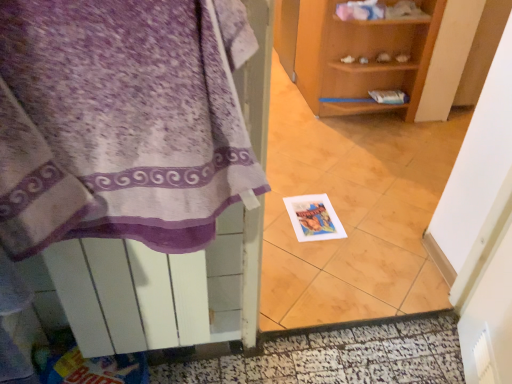
Question: Does wooden shelf at center have a greater height compared to white glossy tile at center?

Choices:
 (A) yes
 (B) no

Answer: (B)

Question: Is the depth of wooden shelf at center greater than that of white glossy tile at center?

Choices:
 (A) yes
 (B) no

Answer: (A)

Question: Does wooden shelf at center have a greater width compared to white glossy tile at center?

Choices:
 (A) no
 (B) yes

Answer: (B)

Question: Is wooden shelf at center positioned in front of white glossy tile at center?

Choices:
 (A) no
 (B) yes

Answer: (A)

Question: Is wooden shelf at center facing towards white glossy tile at center?

Choices:
 (A) no
 (B) yes

Answer: (A)

Question: Considering the positions of wooden shelf at center and white paper postcard at center in the image, is wooden shelf at center taller or shorter than white paper postcard at center?

Choices:
 (A) tall
 (B) short

Answer: (A)

Question: Is point click(x=448, y=41) positioned closer to the camera than point click(x=309, y=198)?

Choices:
 (A) farther
 (B) closer

Answer: (A)

Question: Considering the positions of wooden shelf at center and white paper postcard at center in the image, is wooden shelf at center bigger or smaller than white paper postcard at center?

Choices:
 (A) big
 (B) small

Answer: (A)

Question: Would you say wooden shelf at center is to the left or to the right of white paper postcard at center in the picture?

Choices:
 (A) right
 (B) left

Answer: (A)

Question: From the image's perspective, is white glossy tile at center positioned above or below wooden shelf at center?

Choices:
 (A) below
 (B) above

Answer: (A)

Question: Is white glossy tile at center situated inside wooden shelf at center or outside?

Choices:
 (A) inside
 (B) outside

Answer: (B)

Question: Is white glossy tile at center in front of or behind wooden shelf at center in the image?

Choices:
 (A) front
 (B) behind

Answer: (A)

Question: Considering the positions of white glossy tile at center and wooden shelf at center in the image, is white glossy tile at center taller or shorter than wooden shelf at center?

Choices:
 (A) short
 (B) tall

Answer: (B)

Question: Looking at the image, does white glossy door at lower center seem bigger or smaller compared to white glossy tile at center?

Choices:
 (A) small
 (B) big

Answer: (A)

Question: Which is correct: white glossy door at lower center is inside white glossy tile at center, or outside of it?

Choices:
 (A) outside
 (B) inside

Answer: (A)